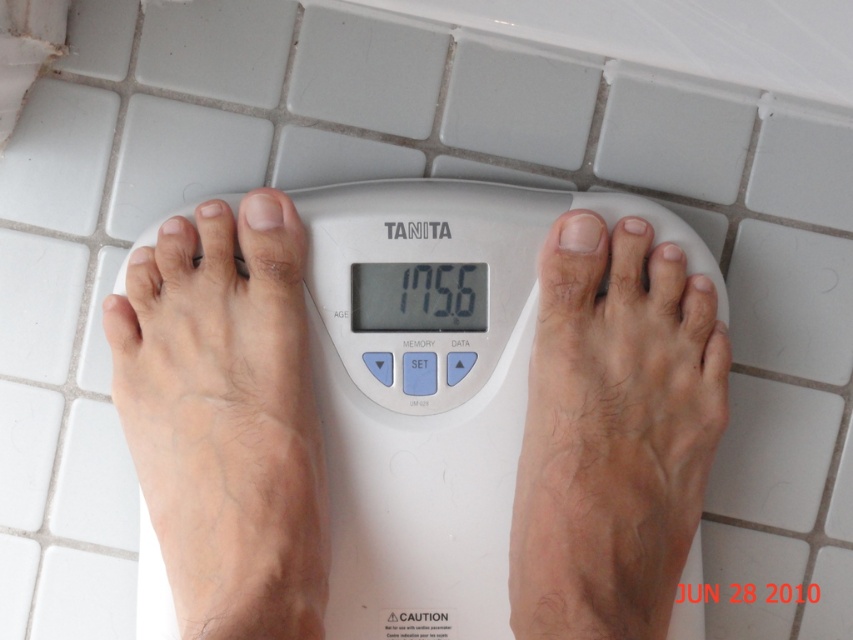
Question: Is white plastic scale at center wider than pale skin at center?

Choices:
 (A) no
 (B) yes

Answer: (B)

Question: Which object appears closest to the camera in this image?

Choices:
 (A) white plastic scale at center
 (B) light skin textured foot at center

Answer: (B)

Question: Is white plastic scale at center to the left of pale skin at center from the viewer's perspective?

Choices:
 (A) no
 (B) yes

Answer: (A)

Question: Does white plastic scale at center appear on the left side of pale skin at center?

Choices:
 (A) yes
 (B) no

Answer: (B)

Question: Which object appears closest to the camera in this image?

Choices:
 (A) white plastic scale at center
 (B) light skin textured foot at center
 (C) pale skin at center

Answer: (C)

Question: Which point appears closest to the camera in this image?

Choices:
 (A) (300, 582)
 (B) (498, 225)

Answer: (A)